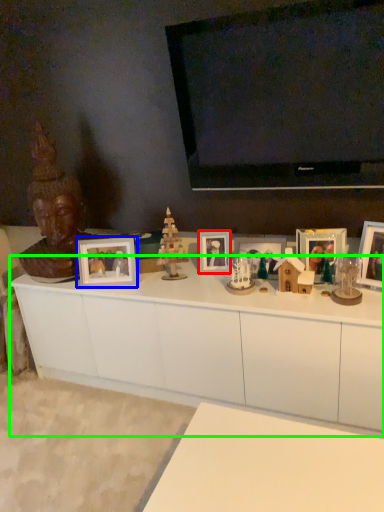
Question: Which object is positioned farthest from picture frame (highlighted by a red box)? Select from picture frame (highlighted by a blue box) and cabinetry (highlighted by a green box).

Choices:
 (A) picture frame
 (B) cabinetry

Answer: (B)